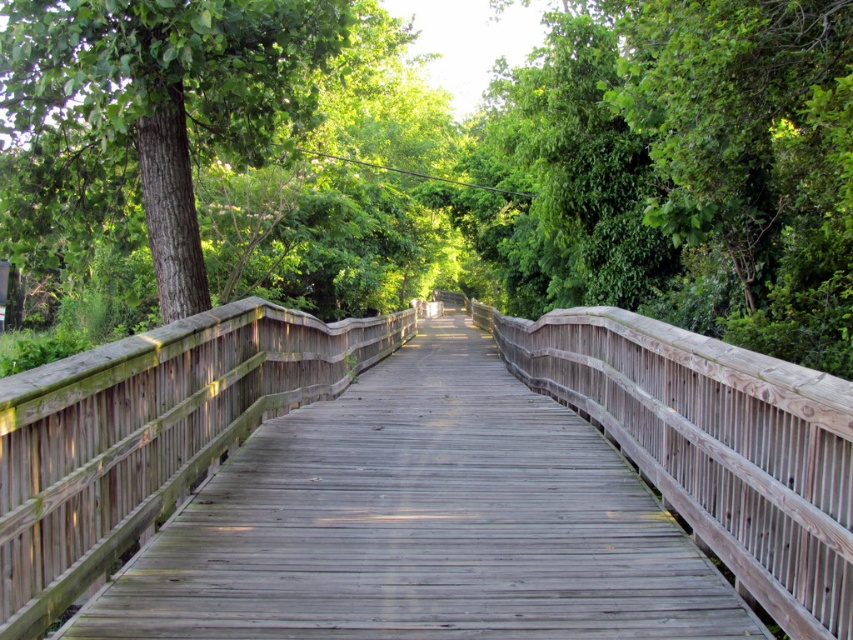
Does point (645, 141) lie behind point (187, 266)?

Yes, it is.

Between point (440, 116) and point (173, 285), which one is positioned behind?

The point (440, 116) is behind.

Find the location of a particular element. The width and height of the screenshot is (853, 640). green leafy tree at center is located at coordinates pos(439,164).

Who is more forward, (384, 132) or (631, 406)?

Point (631, 406)

Does green leafy tree at center have a smaller size compared to weathered wood bridge at center?

No, green leafy tree at center is not smaller than weathered wood bridge at center.

Identify the location of green leafy tree at center. This screenshot has height=640, width=853. (439, 164).

Based on the photo, does weathered wood bridge at center have a smaller size compared to green rough bark tree at left?

Incorrect, weathered wood bridge at center is not smaller in size than green rough bark tree at left.

Who is more distant from viewer, (50, 550) or (51, 184)?

The point (51, 184) is behind.

You are a GUI agent. You are given a task and a screenshot of the screen. Output one action in this format:
    pyautogui.click(x=<x>, y=<y>)
    Task: Click on the weathered wood bridge at center
    This screenshot has width=853, height=640.
    Given the screenshot: What is the action you would take?
    pyautogui.click(x=148, y=435)